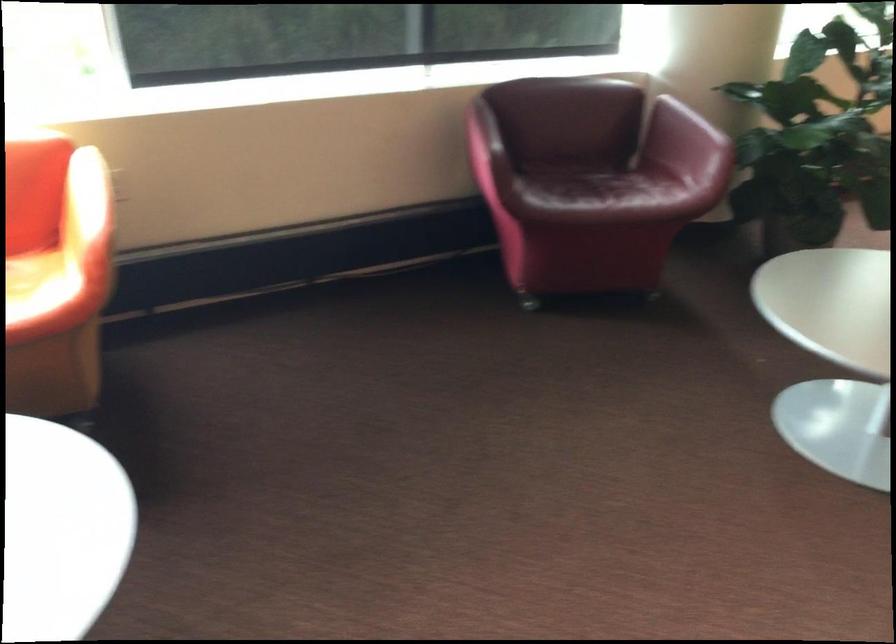
This screenshot has width=896, height=644. Describe the element at coordinates (35, 285) in the screenshot. I see `a orange chair sitting surface` at that location.